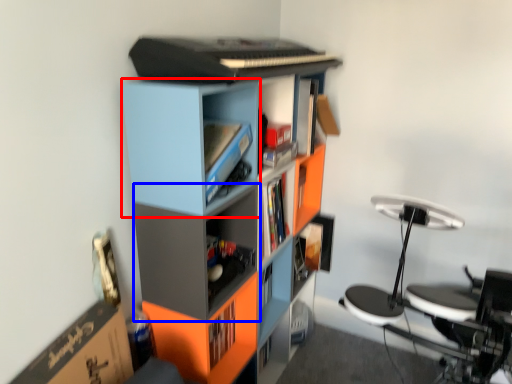
Question: Which point is closer to the camera, cabinet (highlighted by a red box) or shelf (highlighted by a blue box)?

Choices:
 (A) cabinet
 (B) shelf

Answer: (A)